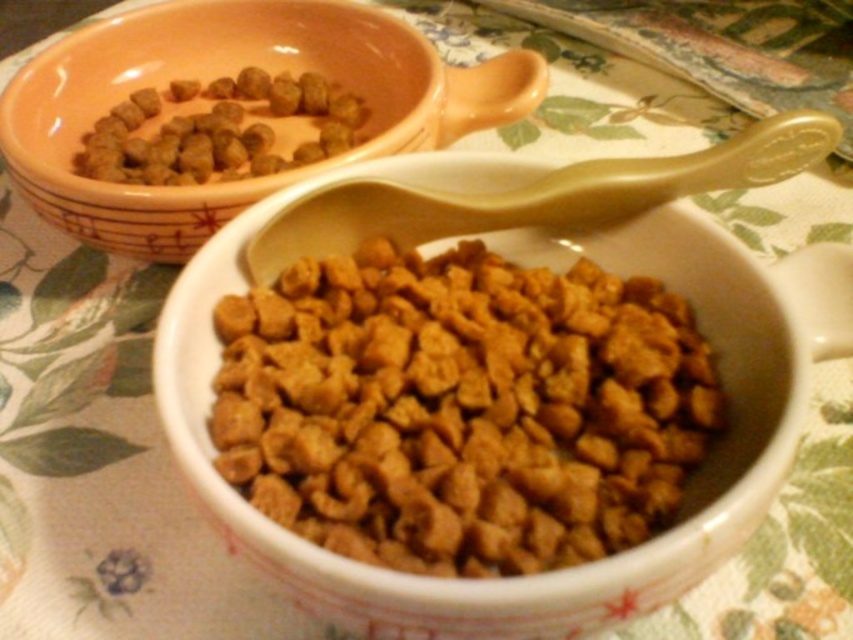
You need to choose between the brown matte dog food at center and the brown matte kibble at upper left to feed your dog. Which one has a bigger portion size?

The brown matte dog food at center has a larger width than the brown matte kibble at upper left, so it likely has a bigger portion size.

You are a robotic arm trying to reach the point at coordinates point [212,440]. The robotic arm has a maximum reach of 10 inches. Can you reach the point?

The distance between the point [212,440] and the camera is 10.89 inches, which is beyond the robotic arm maximum reach of 10 inches. Therefore, the robotic arm cannot reach the point.

You are a dog owner who wants to ensure your pet can easily access their food. You have two bowls on a table with a green and beige floral pattern. The brown matte dog food at center is in one bowl, and the matte ceramic bowl at upper left is the other. Which bowl has a height that allows the dog to reach the food more easily?

The matte ceramic bowl at upper left is taller than the brown matte dog food at center, so the dog can reach the food more easily in the matte ceramic bowl at upper left because it has a lower height. Wait, this might be conflicting. Let me check the description again. The description says the food is not as tall as the bowl, meaning the bowl is taller than the food. So if the bowl is taller, the food is lower inside? Hmm, maybe I need to clarify. The question is about which bowl allows the dog to reach the